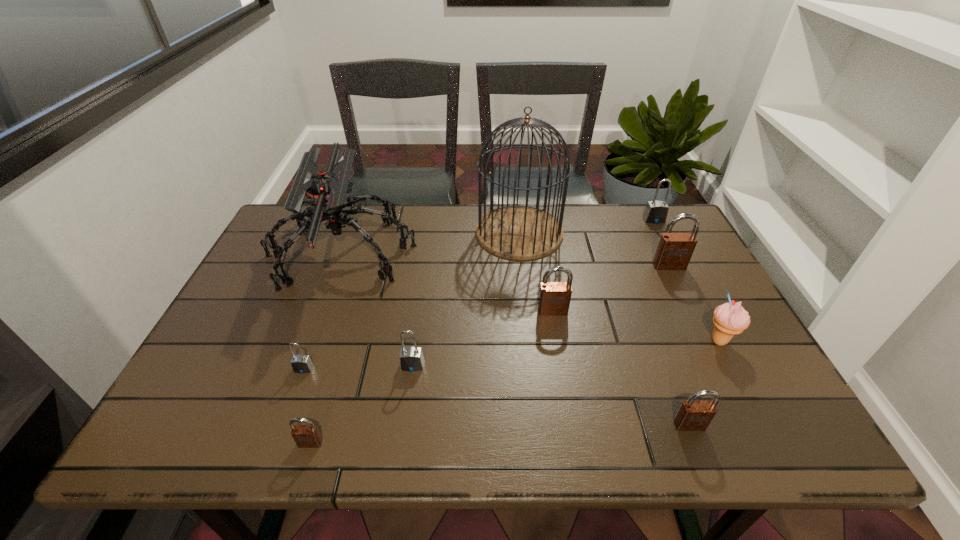
Image resolution: width=960 pixels, height=540 pixels. Find the location of `the tallest object`. the tallest object is located at coordinates (519, 232).

Where is `gray birdcage`? gray birdcage is located at coordinates (519, 232).

This screenshot has height=540, width=960. Identify the location of drone. (326, 192).

Locate an element on the screen. The width and height of the screenshot is (960, 540). black drone is located at coordinates (326, 192).

You are a GUI agent. You are given a task and a screenshot of the screen. Output one action in this format:
    pyautogui.click(x=<x>, y=<y>)
    Task: Click on the biggest brown padlock
    The height and width of the screenshot is (540, 960).
    Given the screenshot: What is the action you would take?
    pyautogui.click(x=674, y=251)

Where is `the tallest padlock`? the tallest padlock is located at coordinates (674, 251).

Where is `the farthest padlock`? the farthest padlock is located at coordinates (655, 212).

At what (x,y) coordinates should I click in order to perform the action: click on the biggest gray padlock. Please return your answer as a coordinate pair (x, y). Looking at the image, I should click on (655, 212).

Where is `the second biggest brown padlock`? The width and height of the screenshot is (960, 540). the second biggest brown padlock is located at coordinates coord(554,299).

This screenshot has height=540, width=960. In order to click on the second farthest brown padlock in this screenshot , I will do `click(554, 299)`.